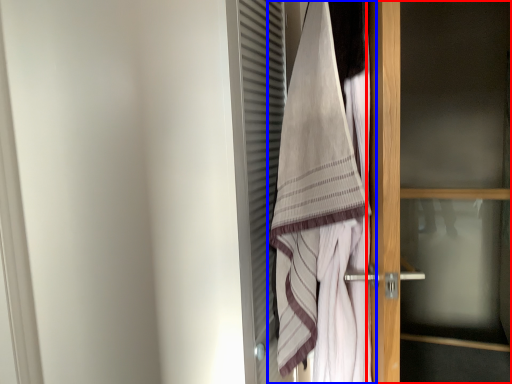
Question: Which object appears closest to the camera in this image, door (highlighted by a red box) or towel (highlighted by a blue box)?

Choices:
 (A) door
 (B) towel

Answer: (B)